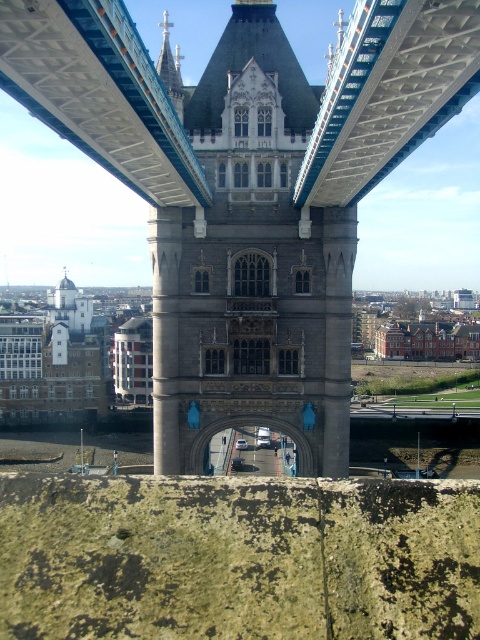
Question: Can you confirm if stone archway at center is positioned below stone gothic arch at center?

Choices:
 (A) yes
 (B) no

Answer: (B)

Question: Which point is farther to the camera?

Choices:
 (A) (187, 339)
 (B) (190, 195)

Answer: (A)

Question: Does stone archway at center appear on the right side of stone gothic arch at center?

Choices:
 (A) no
 (B) yes

Answer: (A)

Question: Can you confirm if stone archway at center is positioned below stone gothic arch at center?

Choices:
 (A) no
 (B) yes

Answer: (A)